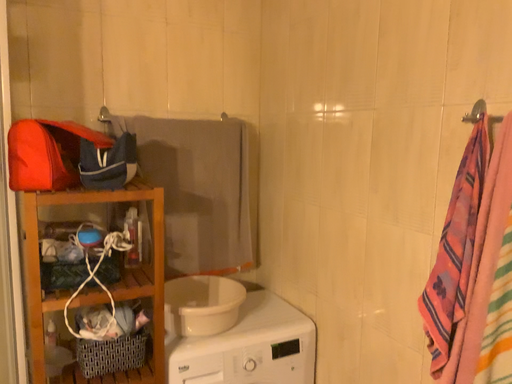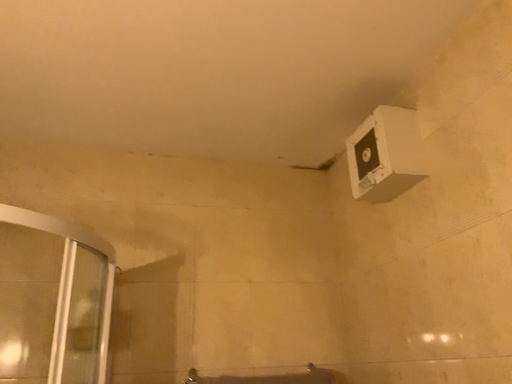
Question: How did the camera likely rotate when shooting the video?

Choices:
 (A) rotated right
 (B) rotated left

Answer: (B)